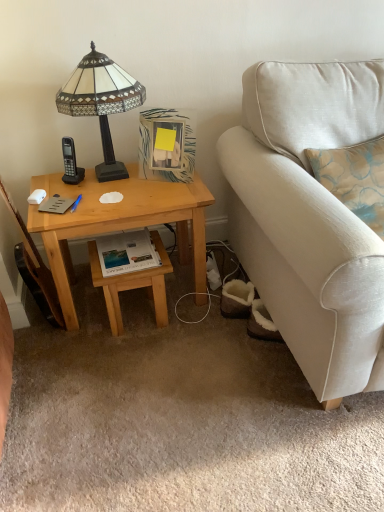
Locate an element on the screen. This screenshot has width=384, height=512. vacant area that is in front of light wood stool at lower center is located at coordinates (137, 359).